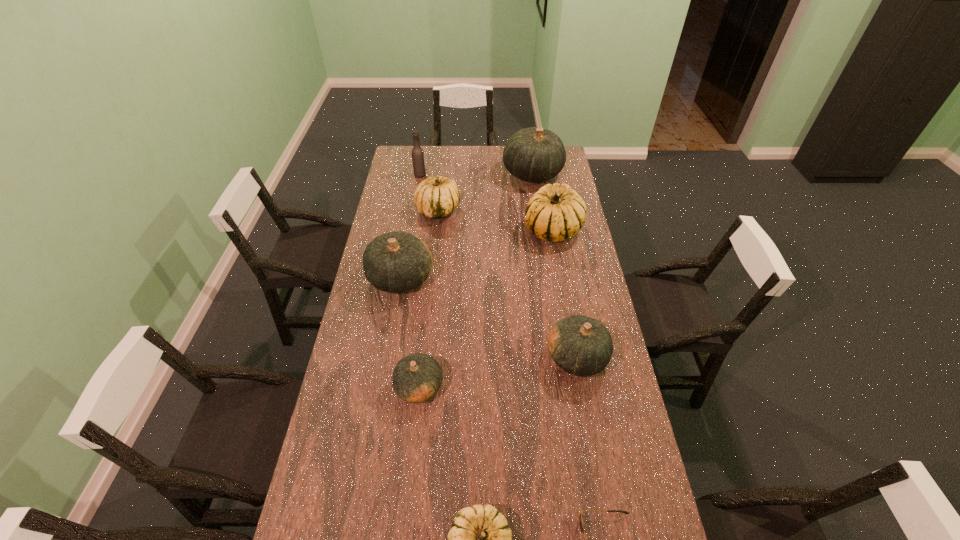
Identify the location of vacant area at the left edge. (374, 435).

Image resolution: width=960 pixels, height=540 pixels. In the image, there is a desktop. Find the location of `vacant space at the right edge`. vacant space at the right edge is located at coordinates (578, 238).

Where is `vacant area that lies between the third biggest orange gourd and the beer bottle`? vacant area that lies between the third biggest orange gourd and the beer bottle is located at coordinates (498, 266).

The height and width of the screenshot is (540, 960). In order to click on free spot between the rightmost white gourd and the beer bottle in this screenshot , I will do `click(487, 202)`.

At what (x,y) coordinates should I click in order to perform the action: click on vacant area that lies between the farthest orange gourd and the second smallest white gourd. Please return your answer as a coordinate pair (x, y). Looking at the image, I should click on pos(485,192).

Locate an element on the screen. This screenshot has height=540, width=960. vacant point located between the beer bottle and the farthest gourd is located at coordinates (476, 174).

The height and width of the screenshot is (540, 960). What are the coordinates of `blank region between the rightmost white gourd and the fourth farthest gourd` in the screenshot? It's located at (477, 254).

Find the location of a particular element. Image resolution: width=960 pixels, height=540 pixels. free area in between the rightmost white gourd and the third smallest orange gourd is located at coordinates (477, 254).

Locate which object is the second closest to the beer bottle. Please provide its 2D coordinates. Your answer should be formatted as a tuple, i.e. [(x, y)], where the tuple contains the x and y coordinates of a point satisfying the conditions above.

[(533, 154)]

Identify the location of object that is the second closest one to the biggest white gourd. (435, 197).